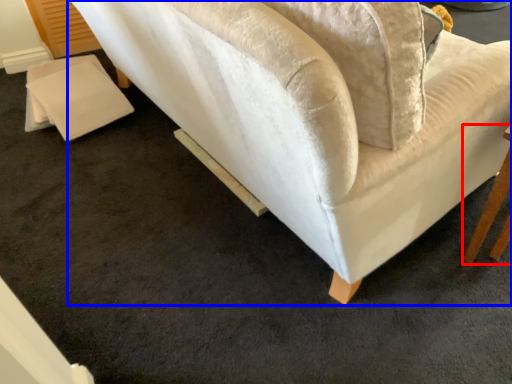
Question: Which object appears closest to the camera in this image, table (highlighted by a red box) or studio couch (highlighted by a blue box)?

Choices:
 (A) table
 (B) studio couch

Answer: (B)